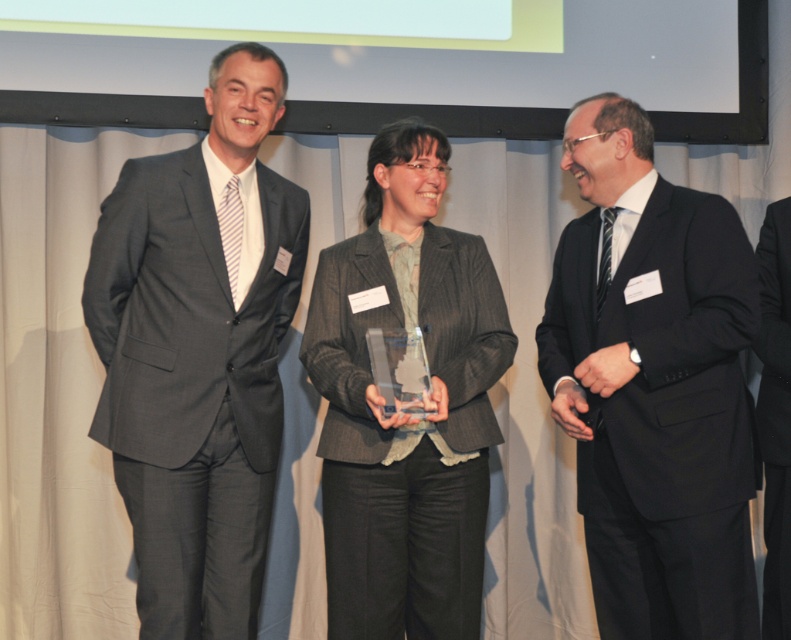
Question: Does matte gray suit at left appear on the right side of gray pinstripe blazer at center?

Choices:
 (A) yes
 (B) no

Answer: (B)

Question: Does gray pinstripe blazer at center have a smaller size compared to black suit at right?

Choices:
 (A) no
 (B) yes

Answer: (A)

Question: Which of the following is the closest to the observer?

Choices:
 (A) (766, 442)
 (B) (612, 269)
 (C) (169, 508)
 (D) (361, 321)

Answer: (C)

Question: Which of the following is the farthest from the observer?

Choices:
 (A) (475, 291)
 (B) (683, 563)

Answer: (A)

Question: Observing the image, what is the correct spatial positioning of gray pinstripe blazer at center in reference to black suit at right?

Choices:
 (A) left
 (B) right

Answer: (A)

Question: Estimate the real-world distances between objects in this image. Which object is closer to the matte black suit at right?

Choices:
 (A) black suit at right
 (B) matte gray suit at left
 (C) gray pinstripe blazer at center

Answer: (C)